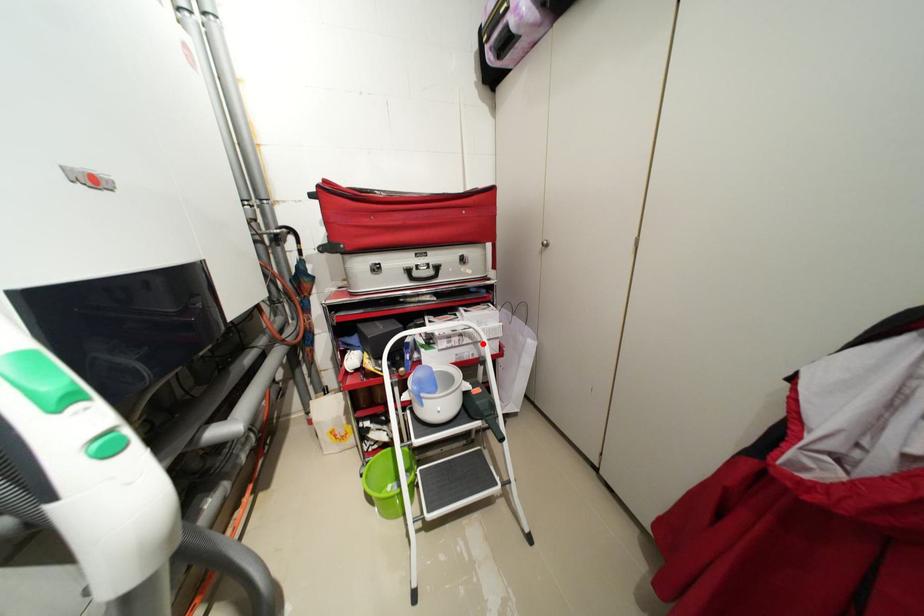
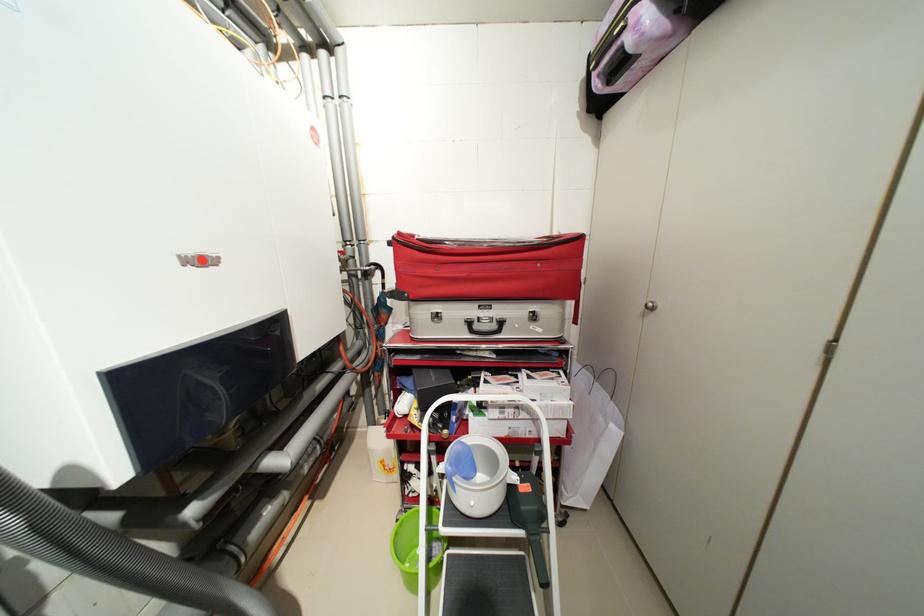
Question: A red point is marked in image1. In image2, is the corresponding 3D point closer to the camera or farther? Reply with the corresponding letter.

Choices:
 (A) The corresponding 3D point is closer.
 (B) The corresponding 3D point is farther.

Answer: (B)